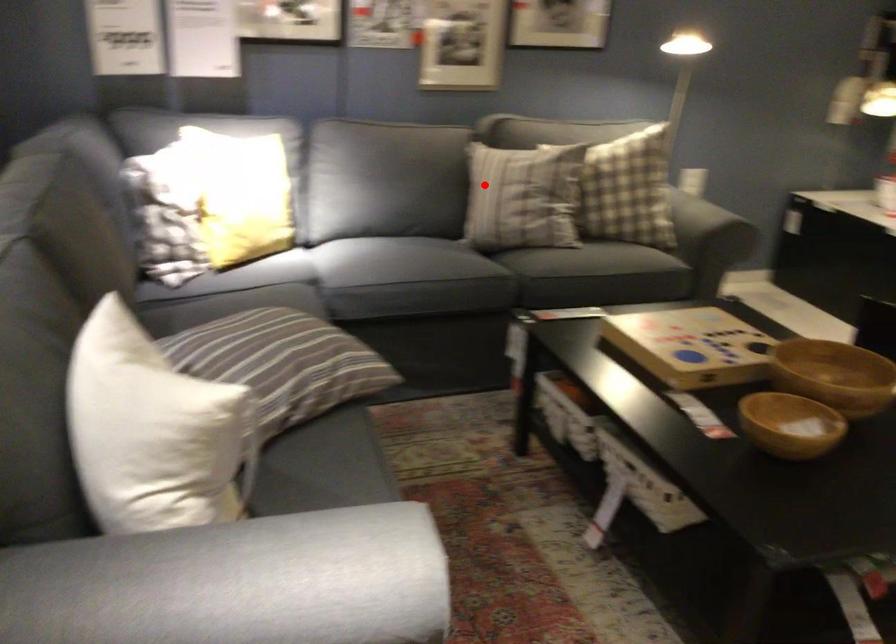
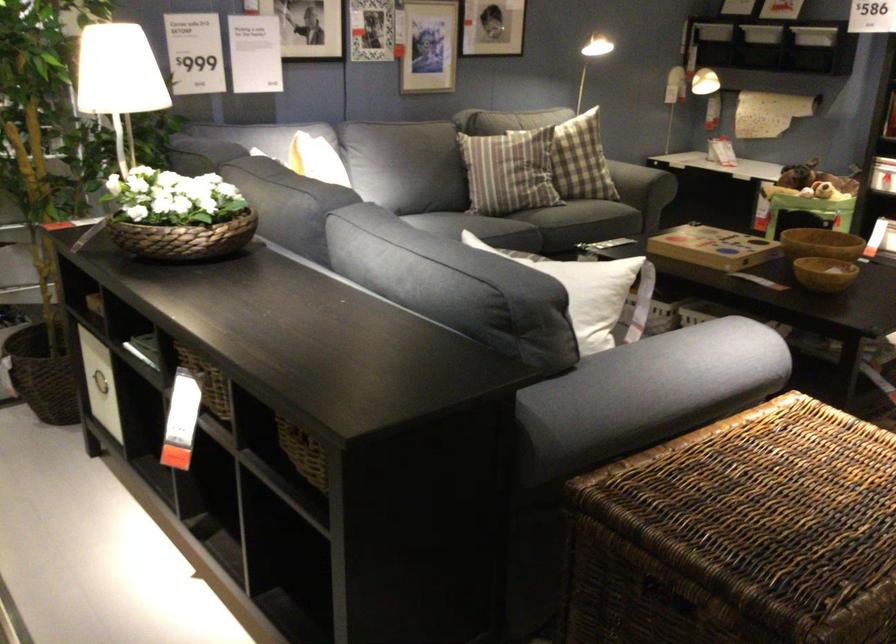
Question: I am providing you with two images of the same scene from different viewpoints. A red point is shown in image1. For the corresponding object point in image2, is it positioned nearer or farther from the camera?

Choices:
 (A) Nearer
 (B) Farther

Answer: (B)